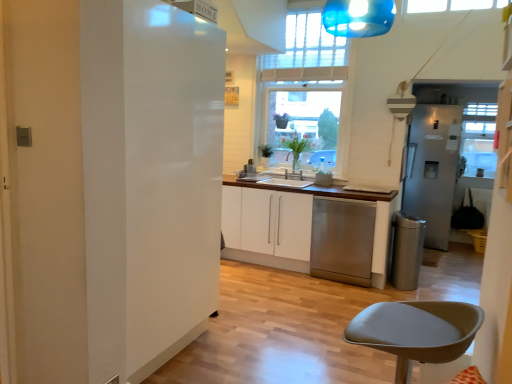
The image size is (512, 384). What do you see at coordinates (407, 251) in the screenshot? I see `stainless steel trash can at lower right` at bounding box center [407, 251].

This screenshot has height=384, width=512. In order to click on stainless steel dishwasher at center in this screenshot , I will do `click(342, 240)`.

The image size is (512, 384). What do you see at coordinates (342, 240) in the screenshot?
I see `stainless steel dishwasher at center` at bounding box center [342, 240].

Identify the location of clear glass window at center. The image size is (512, 384). (306, 55).

The width and height of the screenshot is (512, 384). What do you see at coordinates (267, 227) in the screenshot?
I see `white glossy cabinet at center` at bounding box center [267, 227].

Identify the location of satin silver refrigerator at right, arranged as the second fridge when viewed from the left. The image size is (512, 384). (432, 169).

In order to face satin silver refrigerator at right, the 2th fridge in the front-to-back sequence, should I rotate leftwards or rightwards?

Rotate your view right by about 22.785°.

Find the location of a particular element. This screenshot has height=384, width=512. stainless steel trash can at lower right is located at coordinates (407, 251).

Is satin silver refrigerator at right, which appears as the 1th fridge when viewed from the back, directly adjacent to clear glass window at center?

No, satin silver refrigerator at right, which appears as the 1th fridge when viewed from the back, is not next to clear glass window at center.

In the scene shown: Is satin silver refrigerator at right, which appears as the 1th fridge when viewed from the back, in front of or behind clear glass window at center in the image?

satin silver refrigerator at right, which appears as the 1th fridge when viewed from the back, is behind clear glass window at center.

How much distance is there between satin silver refrigerator at right, which appears as the 1th fridge when viewed from the back, and clear glass window at center?

A distance of 1.97 meters exists between satin silver refrigerator at right, which appears as the 1th fridge when viewed from the back, and clear glass window at center.

Does satin silver refrigerator at right, the first fridge from the right, have a greater width compared to clear glass window at center?

Yes, satin silver refrigerator at right, the first fridge from the right, is wider than clear glass window at center.

Is matte gray stool at lower right positioned with its back to white glossy cabinet at center?

No, white glossy cabinet at center is not at the back of matte gray stool at lower right.

Is matte gray stool at lower right not close to white glossy cabinet at center?

matte gray stool at lower right is far away from white glossy cabinet at center.

Does point (472, 314) appear closer or farther from the camera than point (247, 228)?

Point (472, 314).

Is stainless steel dishwasher at center spatially inside white glossy cabinet at center, or outside of it?

stainless steel dishwasher at center lies outside white glossy cabinet at center.

Image resolution: width=512 pixels, height=384 pixels. What are the coordinates of `cabinetry on the left side of stainless steel dishwasher at center` in the screenshot? It's located at (267, 227).

How distant is stainless steel dishwasher at center from white glossy cabinet at center?

stainless steel dishwasher at center is 17.11 inches away from white glossy cabinet at center.

From the image's perspective, is stainless steel dishwasher at center on top of white glossy cabinet at center?

No, from the image's perspective, stainless steel dishwasher at center is not on top of white glossy cabinet at center.

Between satin silver refrigerator at right, which appears as the 1th fridge when viewed from the back, and stainless steel dishwasher at center, which one appears on the left side from the viewer's perspective?

stainless steel dishwasher at center is more to the left.

Does point (410, 181) come farther from viewer compared to point (315, 263)?

Yes, it is.

Is stainless steel dishwasher at center inside satin silver refrigerator at right, which appears as the 1th fridge when viewed from the back?

No, satin silver refrigerator at right, which appears as the 1th fridge when viewed from the back, does not contain stainless steel dishwasher at center.

From the image's perspective, is satin silver refrigerator at right, the first fridge from the right, above or below stainless steel dishwasher at center?

satin silver refrigerator at right, the first fridge from the right, is situated higher than stainless steel dishwasher at center in the image.

Considering the relative sizes of satin silver refrigerator at right, the 2th fridge in the front-to-back sequence, and white glossy refrigerator at left, the second fridge when ordered from right to left, in the image provided, is satin silver refrigerator at right, the 2th fridge in the front-to-back sequence, taller than white glossy refrigerator at left, the second fridge when ordered from right to left,?

No.

From the image's perspective, who appears lower, satin silver refrigerator at right, the 2th fridge in the front-to-back sequence, or white glossy refrigerator at left, the second fridge when ordered from right to left?

white glossy refrigerator at left, the second fridge when ordered from right to left.

Which object is thinner, satin silver refrigerator at right, arranged as the second fridge when viewed from the left, or white glossy refrigerator at left, arranged as the 1th fridge when viewed from the front?

With smaller width is white glossy refrigerator at left, arranged as the 1th fridge when viewed from the front.

Is satin silver refrigerator at right, the 2th fridge in the front-to-back sequence, positioned beyond the bounds of white glossy refrigerator at left, placed as the 1th fridge when sorted from left to right?

That's correct, satin silver refrigerator at right, the 2th fridge in the front-to-back sequence, is outside of white glossy refrigerator at left, placed as the 1th fridge when sorted from left to right.

Consider the image. From a real-world perspective, is white glossy cabinet at center physically located above or below stainless steel dishwasher at center?

From a real-world perspective, white glossy cabinet at center is physically above stainless steel dishwasher at center.

Could you tell me if white glossy cabinet at center is turned towards stainless steel dishwasher at center?

No, white glossy cabinet at center does not turn towards stainless steel dishwasher at center.

Is white glossy cabinet at center not inside stainless steel dishwasher at center?

Yes.

Would you say matte gray stool at lower right is part of white glossy cabinet at center's contents?

That's incorrect, matte gray stool at lower right is not inside white glossy cabinet at center.

From a real-world perspective, is white glossy cabinet at center located higher than matte gray stool at lower right?

No, from a real-world perspective, white glossy cabinet at center is not above matte gray stool at lower right.

Is white glossy cabinet at center looking in the opposite direction of matte gray stool at lower right?

No, white glossy cabinet at center's orientation is not away from matte gray stool at lower right.

Is white glossy cabinet at center positioned far away from matte gray stool at lower right?

Absolutely, white glossy cabinet at center is distant from matte gray stool at lower right.

I want to click on window located in front of the satin silver refrigerator at right, arranged as the second fridge when viewed from the left, so click(x=306, y=55).

Identify the location of chair below the white glossy cabinet at center (from the image's perspective). This screenshot has width=512, height=384. (416, 331).

From the image, which object appears to be nearer to stainless steel trash can at lower right, clear glass window at center or satin silver refrigerator at right, arranged as the second fridge when viewed from the left?

Among the two, clear glass window at center is located nearer to stainless steel trash can at lower right.

In the scene shown: Based on their spatial positions, is stainless steel dishwasher at center or satin silver refrigerator at right, which appears as the 1th fridge when viewed from the back, closer to clear glass window at center?

stainless steel dishwasher at center is closer to clear glass window at center.

From the image, which object appears to be nearer to stainless steel trash can at lower right, white glossy cabinet at center or white glossy refrigerator at left, arranged as the 1th fridge when viewed from the front?

white glossy cabinet at center.

From the image, which object appears to be farther from white glossy cabinet at center, satin silver refrigerator at right, arranged as the second fridge when viewed from the left, or matte gray stool at lower right?

The object further to white glossy cabinet at center is matte gray stool at lower right.

When comparing their distances from satin silver refrigerator at right, the 2th fridge in the front-to-back sequence, does white glossy refrigerator at left, placed as the 1th fridge when sorted from left to right, or stainless steel dishwasher at center seem further?

white glossy refrigerator at left, placed as the 1th fridge when sorted from left to right.

Looking at the image, which one is located closer to clear glass window at center, matte gray stool at lower right or white glossy cabinet at center?

Among the two, white glossy cabinet at center is located nearer to clear glass window at center.

When comparing their distances from clear glass window at center, does stainless steel dishwasher at center or white glossy refrigerator at left, which is counted as the 2th fridge, starting from the back, seem closer?

Among the two, stainless steel dishwasher at center is located nearer to clear glass window at center.

Which object lies further to the anchor point white glossy cabinet at center, white glossy refrigerator at left, arranged as the 1th fridge when viewed from the front, or matte gray stool at lower right?

matte gray stool at lower right is positioned further to the anchor white glossy cabinet at center.

Locate an element on the screen. The image size is (512, 384). appliance between matte gray stool at lower right and satin silver refrigerator at right, the 2th fridge in the front-to-back sequence, in the front-back direction is located at coordinates (407, 251).

Image resolution: width=512 pixels, height=384 pixels. I want to click on appliance between white glossy refrigerator at left, the second fridge when ordered from right to left, and white glossy cabinet at center from front to back, so click(x=407, y=251).

You are a GUI agent. You are given a task and a screenshot of the screen. Output one action in this format:
    pyautogui.click(x=<x>, y=<y>)
    Task: Click on the dish washer positioned between matte gray stool at lower right and satin silver refrigerator at right, the first fridge from the right, from near to far
    The width and height of the screenshot is (512, 384).
    Given the screenshot: What is the action you would take?
    pyautogui.click(x=342, y=240)

Where is `dish washer located between white glossy refrigerator at left, placed as the 1th fridge when sorted from left to right, and clear glass window at center in the depth direction`? The image size is (512, 384). dish washer located between white glossy refrigerator at left, placed as the 1th fridge when sorted from left to right, and clear glass window at center in the depth direction is located at coordinates (342, 240).